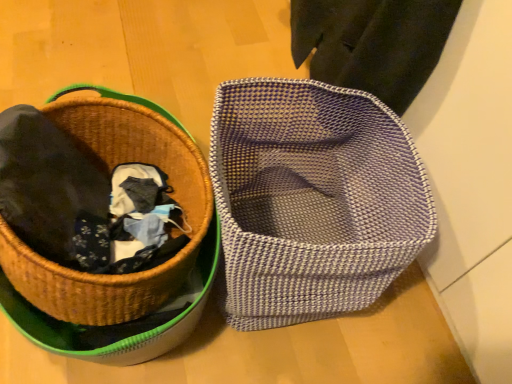
What is the approximate width of woven brown picnic basket at left?

It is 19.49 inches.

You are a GUI agent. You are given a task and a screenshot of the screen. Output one action in this format:
    pyautogui.click(x=<x>, y=<y>)
    Task: Click on the woven brown picnic basket at left
    The width and height of the screenshot is (512, 384).
    Given the screenshot: What is the action you would take?
    pyautogui.click(x=110, y=170)

In order to face woven brown picnic basket at left, should I rotate leftwards or rightwards?

Turn left approximately 21.317 degrees to face it.

Describe the element at coordinates (110, 170) in the screenshot. I see `woven brown picnic basket at left` at that location.

Image resolution: width=512 pixels, height=384 pixels. What are the coordinates of `textured woven basket at center` in the screenshot? It's located at (312, 200).

The width and height of the screenshot is (512, 384). Describe the element at coordinates (312, 200) in the screenshot. I see `textured woven basket at center` at that location.

The width and height of the screenshot is (512, 384). I want to click on woven brown picnic basket at left, so click(110, 170).

Considering the relative positions of textured woven basket at center and woven brown picnic basket at left in the image provided, is textured woven basket at center to the left of woven brown picnic basket at left from the viewer's perspective?

In fact, textured woven basket at center is to the right of woven brown picnic basket at left.

Considering their positions, is textured woven basket at center located in front of or behind woven brown picnic basket at left?

textured woven basket at center is positioned farther from the viewer than woven brown picnic basket at left.

Between point (229, 129) and point (98, 117), which one is positioned in front?

The point (229, 129) is in front.

From the image's perspective, which is above, textured woven basket at center or woven brown picnic basket at left?

woven brown picnic basket at left is shown above in the image.

From a real-world perspective, who is located higher, textured woven basket at center or woven brown picnic basket at left?

woven brown picnic basket at left.

Is textured woven basket at center wider or thinner than woven brown picnic basket at left?

In the image, textured woven basket at center appears to be more narrow than woven brown picnic basket at left.

Who is shorter, textured woven basket at center or woven brown picnic basket at left?

With less height is woven brown picnic basket at left.

Considering the relative sizes of textured woven basket at center and woven brown picnic basket at left in the image provided, is textured woven basket at center bigger than woven brown picnic basket at left?

No, textured woven basket at center is not bigger than woven brown picnic basket at left.

Is textured woven basket at center surrounding woven brown picnic basket at left?

No, woven brown picnic basket at left is located outside of textured woven basket at center.

Is textured woven basket at center touching woven brown picnic basket at left?

No, textured woven basket at center is not making contact with woven brown picnic basket at left.

Consider the image. Is textured woven basket at center oriented away from woven brown picnic basket at left?

No, woven brown picnic basket at left is not at the back of textured woven basket at center.

How many degrees apart are the facing directions of textured woven basket at center and woven brown picnic basket at left?

9.99 degrees.

Measure the distance from textured woven basket at center to woven brown picnic basket at left.

23.89 centimeters.

Locate an element on the screen. basket behind the woven brown picnic basket at left is located at coordinates (312, 200).

Does woven brown picnic basket at left appear on the right side of textured woven basket at center?

No.

Who is more distant, woven brown picnic basket at left or textured woven basket at center?

textured woven basket at center is behind.

Between point (122, 124) and point (319, 99), which one is positioned behind?

Positioned behind is point (122, 124).

From the image's perspective, is woven brown picnic basket at left located above textured woven basket at center?

Yes, from the image's perspective, woven brown picnic basket at left is on top of textured woven basket at center.

From a real-world perspective, is woven brown picnic basket at left above or below textured woven basket at center?

Clearly, from a real-world perspective, woven brown picnic basket at left is above textured woven basket at center.

Does woven brown picnic basket at left have a greater width compared to textured woven basket at center?

Indeed, woven brown picnic basket at left has a greater width compared to textured woven basket at center.

Considering the sizes of objects woven brown picnic basket at left and textured woven basket at center in the image provided, who is taller, woven brown picnic basket at left or textured woven basket at center?

textured woven basket at center.

Can you confirm if woven brown picnic basket at left is smaller than textured woven basket at center?

No, woven brown picnic basket at left is not smaller than textured woven basket at center.

Is woven brown picnic basket at left not inside textured woven basket at center?

woven brown picnic basket at left lies outside textured woven basket at center's area.

Are woven brown picnic basket at left and textured woven basket at center far apart?

No, there isn't a large distance between woven brown picnic basket at left and textured woven basket at center.

From the picture: Could you tell me if woven brown picnic basket at left is facing textured woven basket at center?

No, woven brown picnic basket at left is not turned towards textured woven basket at center.

Identify the location of picnic basket in front of the textured woven basket at center. The height and width of the screenshot is (384, 512). (110, 170).

Find the location of `picnic basket that appears above the textured woven basket at center (from the image's perspective)`. picnic basket that appears above the textured woven basket at center (from the image's perspective) is located at coordinates (110, 170).

The height and width of the screenshot is (384, 512). I want to click on picnic basket on the left of textured woven basket at center, so click(110, 170).